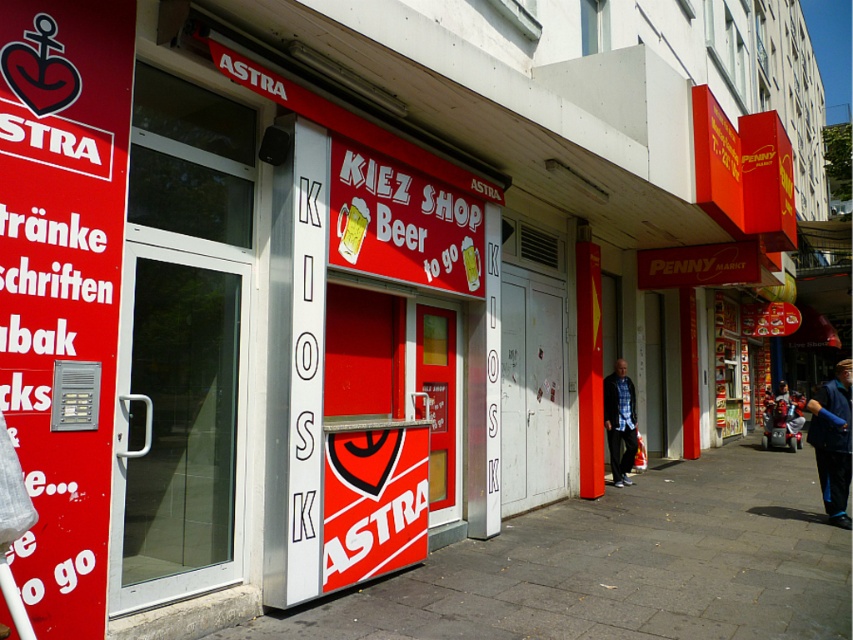
You are trying to decide which clothing item to take with you based on size. You need something that is wider. Which one should you choose between the blue fabric jacket at lower right and the blue plaid shirt at center?

The blue plaid shirt at center is wider than the blue fabric jacket at lower right, so you should choose the blue plaid shirt at center.

You are standing in front of the Astra kiosk and need to find the blue plaid shirt at center. Based on the coordinates provided, in which direction should you look to locate it?

The blue plaid shirt at center is located at coordinates point (619, 420), so you should look towards the center of the image to find it.